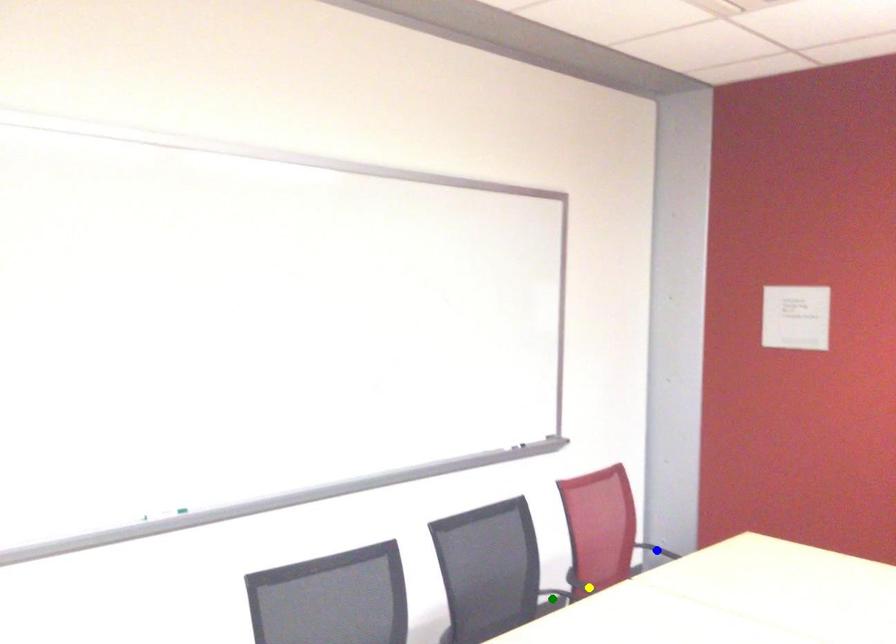
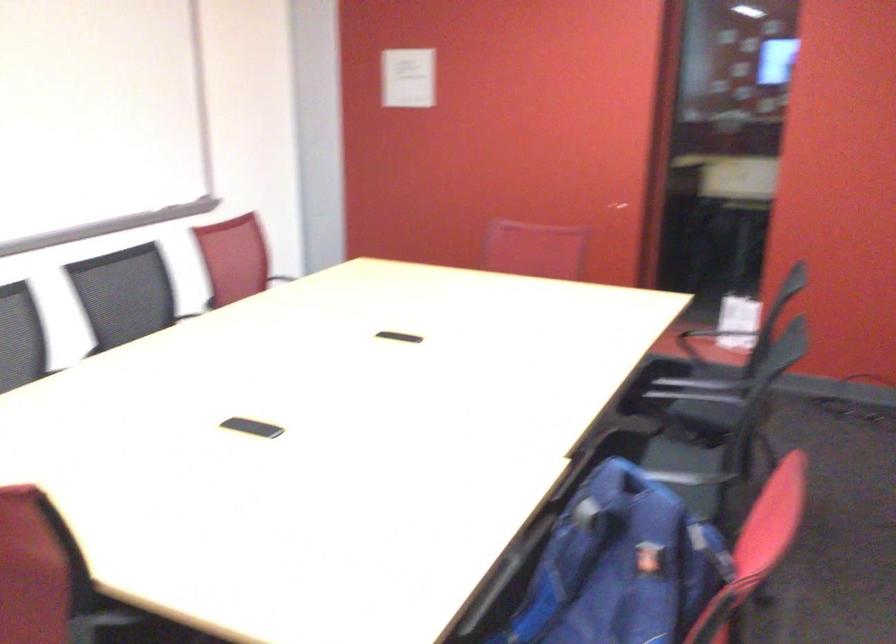
I am providing you with two images of the same scene from different viewpoints. Three points are marked in image1. Which point corresponds to a part or object that is occluded in image2?In image1, three points are marked. Which of them correspond to a part or object that is occluded in image2?Among the three points shown in image1, which one corresponds to a part or object that is no longer visible due to occlusion in image2?

yellow point, green point, blue point